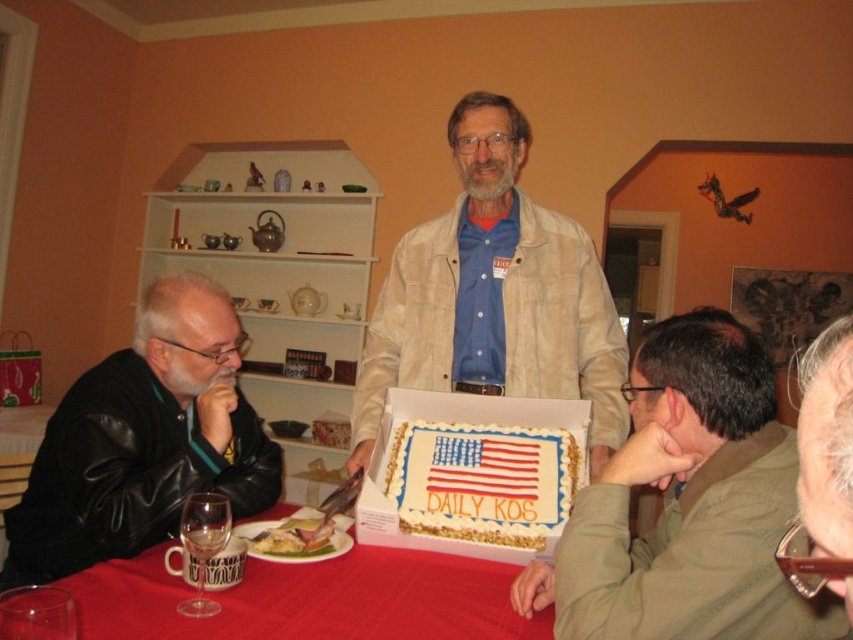
Question: Which object is farther from the camera taking this photo?

Choices:
 (A) smooth red tablecloth at lower center
 (B) matte khaki shirt at lower right
 (C) light beige jacket at center

Answer: (C)

Question: Does black leather jacket at left appear under white frosted cake with american flag design at center?

Choices:
 (A) yes
 (B) no

Answer: (A)

Question: Is the position of black leather jacket at left less distant than that of white frosted cake with american flag design at center?

Choices:
 (A) no
 (B) yes

Answer: (A)

Question: Which is farther from the white frosted cake with american flag design at center?

Choices:
 (A) light beige jacket at center
 (B) smooth red tablecloth at lower center
 (C) matte khaki shirt at lower right
 (D) black leather jacket at left

Answer: (D)

Question: Can you confirm if light beige jacket at center is positioned above smooth red tablecloth at lower center?

Choices:
 (A) no
 (B) yes

Answer: (B)

Question: Which object is closer to the camera taking this photo?

Choices:
 (A) light beige jacket at center
 (B) black leather jacket at left
 (C) smooth red tablecloth at lower center
 (D) matte khaki shirt at lower right

Answer: (D)